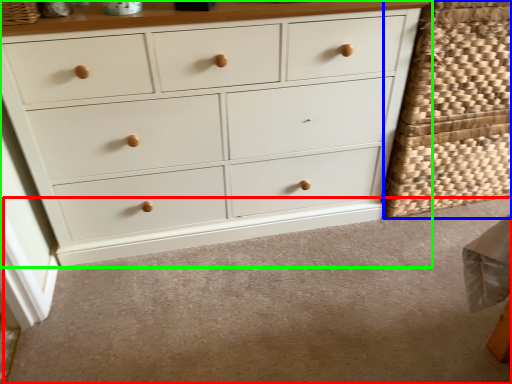
Question: Which is nearer to the plain (highlighted by a red box)? basket (highlighted by a blue box) or chest of drawers (highlighted by a green box).

Choices:
 (A) basket
 (B) chest of drawers

Answer: (B)